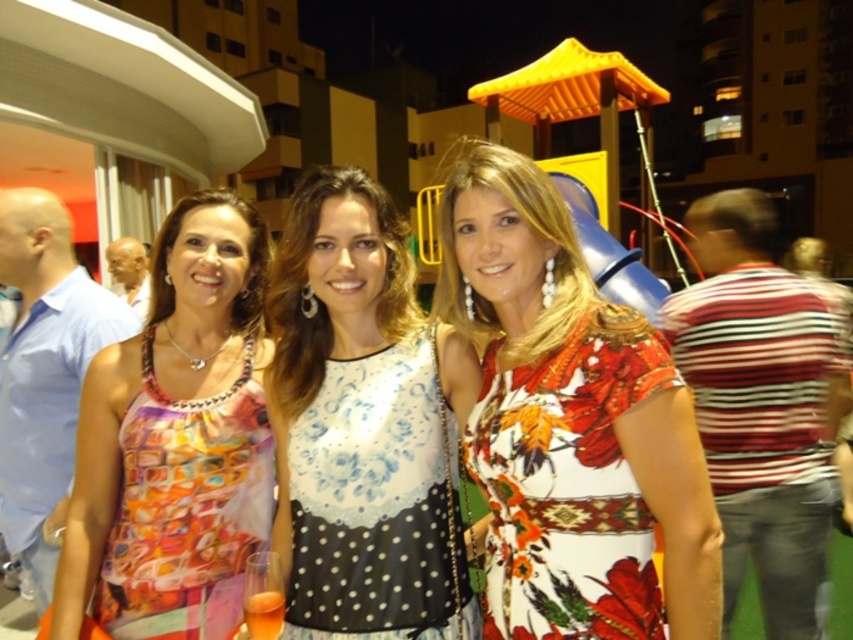
You are a photographer trying to capture a closeup shot of the woman in the sleeveless dress with a vibrant multicolored pattern. You notice two points marked in the image at coordinates point (624,410) and point (415,403). Which point should you focus on to ensure the woman in the sleeveless dress is in focus?

Point (624,410) is closer to the camera than point (415,403), so focusing on point (624,410) will ensure the woman in the sleeveless dress is in focus.

You are a photographer at a party and need to ensure all guests are visible in the group photo. The two central women are wearing a multicolored printed dress at center and a white lace tank top at center. Which clothing item will appear bigger in the photo?

The multicolored printed dress at center will appear bigger in the photo because it has a larger size compared to the white lace tank top at center.